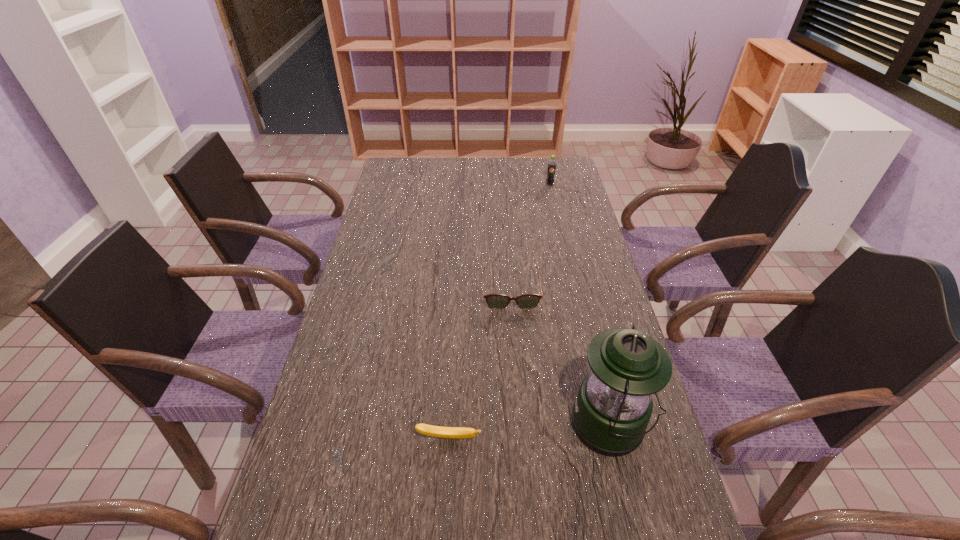
Where is `lantern`? The image size is (960, 540). lantern is located at coordinates (613, 407).

You are a GUI agent. You are given a task and a screenshot of the screen. Output one action in this format:
    pyautogui.click(x=<x>, y=<y>)
    Task: Click on the third shortest object
    
    Given the screenshot: What is the action you would take?
    pyautogui.click(x=551, y=169)

Locate an element on the screen. the farthest object is located at coordinates click(x=551, y=169).

Find the location of a particular element. The image size is (960, 540). the second farthest object is located at coordinates (495, 301).

This screenshot has height=540, width=960. I want to click on spectacles, so click(495, 301).

You are a GUI agent. You are given a task and a screenshot of the screen. Output one action in this format:
    pyautogui.click(x=<x>, y=<y>)
    Task: Click on the leftmost object
    The height and width of the screenshot is (540, 960).
    Given the screenshot: What is the action you would take?
    pyautogui.click(x=435, y=431)

Locate an element on the screen. vacant space located on the back of the lantern is located at coordinates (x=576, y=281).

Locate an element on the screen. The image size is (960, 540). free point located 0.380m on the front label of the farthest object is located at coordinates (564, 245).

Identify the location of vacant area situated 0.120m at the front view of the second farthest object. (515, 342).

This screenshot has width=960, height=540. Find the location of `vacant space located 0.100m at the stem of the banana`. vacant space located 0.100m at the stem of the banana is located at coordinates (445, 491).